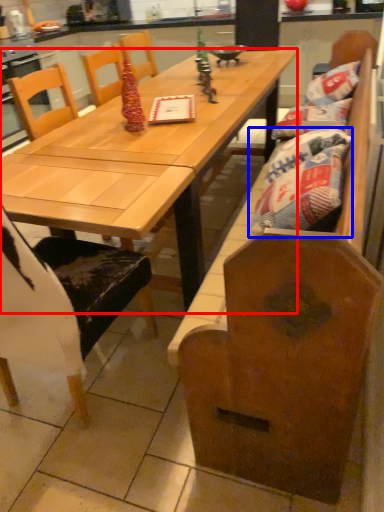
Question: Among these objects, which one is nearest to the camera, table (highlighted by a red box) or material (highlighted by a blue box)?

Choices:
 (A) table
 (B) material

Answer: (A)